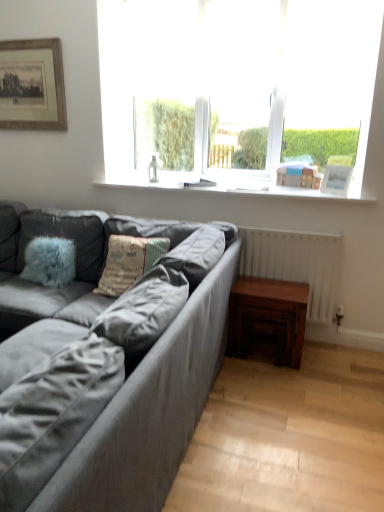
Question: Considering the relative sizes of transparent glass window at upper center and wooden framed print at upper left, the 1th picture frame positioned from the left, in the image provided, is transparent glass window at upper center thinner than wooden framed print at upper left, the 1th picture frame positioned from the left,?

Choices:
 (A) yes
 (B) no

Answer: (B)

Question: Is transparent glass window at upper center oriented towards wooden framed print at upper left, the 1th picture frame positioned from the left?

Choices:
 (A) yes
 (B) no

Answer: (B)

Question: Is transparent glass window at upper center beside wooden framed print at upper left, arranged as the second picture frame when ordered from the bottom?

Choices:
 (A) no
 (B) yes

Answer: (A)

Question: Considering the relative sizes of transparent glass window at upper center and wooden framed print at upper left, which is counted as the 1th picture frame, starting from the top, in the image provided, is transparent glass window at upper center bigger than wooden framed print at upper left, which is counted as the 1th picture frame, starting from the top,?

Choices:
 (A) no
 (B) yes

Answer: (B)

Question: Is transparent glass window at upper center not inside wooden framed print at upper left, which ranks as the 2th picture frame in front-to-back order?

Choices:
 (A) no
 (B) yes

Answer: (B)

Question: Is wooden framed print at upper left, which is counted as the 1th picture frame, starting from the top, situated inside transparent glass window at upper center or outside?

Choices:
 (A) inside
 (B) outside

Answer: (B)

Question: From a real-world perspective, is wooden framed print at upper left, which ranks as the 2th picture frame in front-to-back order, positioned above or below transparent glass window at upper center?

Choices:
 (A) above
 (B) below

Answer: (B)

Question: In terms of size, does wooden framed print at upper left, the second picture frame positioned from the right, appear bigger or smaller than transparent glass window at upper center?

Choices:
 (A) small
 (B) big

Answer: (A)

Question: From the image's perspective, is wooden framed print at upper left, arranged as the second picture frame when ordered from the bottom, positioned above or below transparent glass window at upper center?

Choices:
 (A) below
 (B) above

Answer: (B)

Question: Is transparent glass window at upper center taller or shorter than suede gray couch at left?

Choices:
 (A) short
 (B) tall

Answer: (B)

Question: Considering the positions of transparent glass window at upper center and suede gray couch at left in the image, is transparent glass window at upper center wider or thinner than suede gray couch at left?

Choices:
 (A) wide
 (B) thin

Answer: (B)

Question: Choose the correct answer: Is transparent glass window at upper center inside suede gray couch at left or outside it?

Choices:
 (A) outside
 (B) inside

Answer: (A)

Question: Is transparent glass window at upper center to the left or to the right of suede gray couch at left in the image?

Choices:
 (A) left
 (B) right

Answer: (B)

Question: In terms of width, does textured fabric pillow at center look wider or thinner when compared to wooden framed print at upper left, the second picture frame positioned from the right?

Choices:
 (A) thin
 (B) wide

Answer: (B)

Question: In the image, is textured fabric pillow at center positioned in front of or behind wooden framed print at upper left, which ranks as the 2th picture frame in front-to-back order?

Choices:
 (A) front
 (B) behind

Answer: (A)